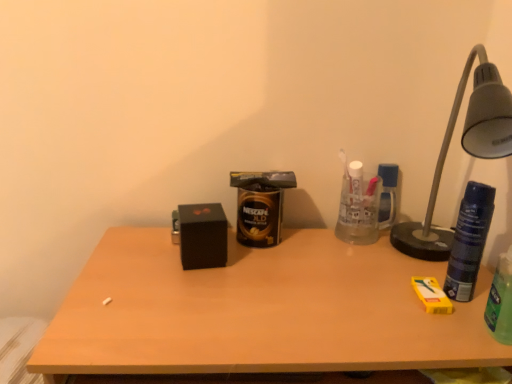
You are a GUI agent. You are given a task and a screenshot of the screen. Output one action in this format:
    pyautogui.click(x=<x>, y=<y>)
    Task: Click on the spots to the right of black matte box at center
    The image size is (512, 384).
    Given the screenshot: What is the action you would take?
    pyautogui.click(x=290, y=264)